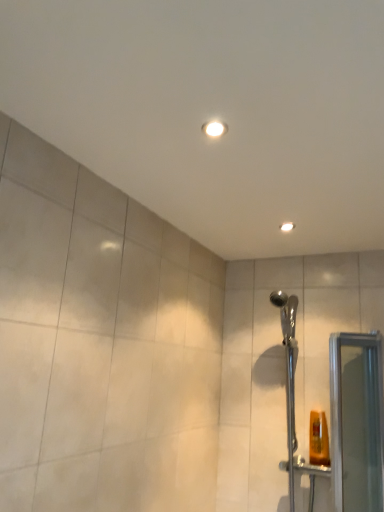
The width and height of the screenshot is (384, 512). Find the location of `chrome metallic shower head at right`. chrome metallic shower head at right is located at coordinates (x=289, y=373).

At what (x,y) coordinates should I click in order to perform the action: click on chrome metallic shower head at right. Please return your answer as a coordinate pair (x, y). Looking at the image, I should click on (289, 373).

Which of these two, clear glass screen door at right or chrome metallic shower head at right, is bigger?

chrome metallic shower head at right is bigger.

In the image, there is a chrome metallic shower head at right. Where is `screen door below it (from the image's perspective)`? screen door below it (from the image's perspective) is located at coordinates (356, 421).

Is chrome metallic shower head at right surrounded by clear glass screen door at right?

That's incorrect, chrome metallic shower head at right is not inside clear glass screen door at right.

Does clear glass screen door at right have a lesser height compared to chrome metallic shower head at right?

Correct, clear glass screen door at right is not as tall as chrome metallic shower head at right.

Locate an element on the screen. This screenshot has width=384, height=512. light fixture above the clear glass screen door at right (from the image's perspective) is located at coordinates (287, 227).

Which is behind, point (284, 226) or point (363, 335)?

The point (363, 335) is farther.

Considering the relative sizes of matte white light fixture at upper center and clear glass screen door at right in the image provided, is matte white light fixture at upper center wider than clear glass screen door at right?

Incorrect, the width of matte white light fixture at upper center does not surpass that of clear glass screen door at right.

Looking at their sizes, would you say matte white light fixture at upper center is wider or thinner than chrome metallic shower head at right?

Considering their sizes, matte white light fixture at upper center looks slimmer than chrome metallic shower head at right.

From a real-world perspective, is matte white light fixture at upper center on top of chrome metallic shower head at right?

Yes, from a real-world perspective, matte white light fixture at upper center is over chrome metallic shower head at right

Can you confirm if matte white light fixture at upper center is positioned to the right of chrome metallic shower head at right?

Incorrect, matte white light fixture at upper center is not on the right side of chrome metallic shower head at right.

Is matte white light fixture at upper center oriented away from chrome metallic shower head at right?

matte white light fixture at upper center is not turned away from chrome metallic shower head at right.

Which is more to the left, chrome metallic shower head at right or clear glass screen door at right?

From the viewer's perspective, chrome metallic shower head at right appears more on the left side.

In the scene shown: Are chrome metallic shower head at right and clear glass screen door at right located far from each other?

No, chrome metallic shower head at right is not far from clear glass screen door at right.

Is clear glass screen door at right at the back of chrome metallic shower head at right?

chrome metallic shower head at right is not turned away from clear glass screen door at right.

Considering the sizes of objects chrome metallic shower head at right and clear glass screen door at right in the image provided, who is shorter, chrome metallic shower head at right or clear glass screen door at right?

clear glass screen door at right.

From the image's perspective, is clear glass screen door at right located beneath matte white light fixture at upper center?

Correct, clear glass screen door at right appears lower than matte white light fixture at upper center in the image.

From a real-world perspective, which is physically below, clear glass screen door at right or matte white light fixture at upper center?

clear glass screen door at right is physically lower.

Does clear glass screen door at right have a smaller size compared to matte white light fixture at upper center?

Incorrect, clear glass screen door at right is not smaller in size than matte white light fixture at upper center.

Does clear glass screen door at right turn towards matte white light fixture at upper center?

No, clear glass screen door at right is not aimed at matte white light fixture at upper center.

You are a GUI agent. You are given a task and a screenshot of the screen. Output one action in this format:
    pyautogui.click(x=<x>, y=<y>)
    Task: Click on the shower below the matte white light fixture at upper center (from the image's perspective)
    The width and height of the screenshot is (384, 512).
    Given the screenshot: What is the action you would take?
    pyautogui.click(x=289, y=373)

From a real-world perspective, who is located lower, chrome metallic shower head at right or matte white light fixture at upper center?

chrome metallic shower head at right.

Which object is positioned more to the right, chrome metallic shower head at right or matte white light fixture at upper center?

Positioned to the right is chrome metallic shower head at right.

Where is `shower that appears above the clear glass screen door at right (from a real-world perspective)`? The height and width of the screenshot is (512, 384). shower that appears above the clear glass screen door at right (from a real-world perspective) is located at coordinates (289, 373).

Where is `light fixture lying behind the clear glass screen door at right`? light fixture lying behind the clear glass screen door at right is located at coordinates (287, 227).

Based on their spatial positions, is chrome metallic shower head at right or matte white light fixture at upper center further from clear glass screen door at right?

Based on the image, matte white light fixture at upper center appears to be further to clear glass screen door at right.

Which object lies further to the anchor point chrome metallic shower head at right, matte white light fixture at upper center or clear glass screen door at right?

matte white light fixture at upper center lies further to chrome metallic shower head at right than the other object.

Based on their spatial positions, is chrome metallic shower head at right or clear glass screen door at right closer to matte white light fixture at upper center?

chrome metallic shower head at right lies closer to matte white light fixture at upper center than the other object.

When comparing their distances from matte white light fixture at upper center, does clear glass screen door at right or chrome metallic shower head at right seem closer?

Among the two, chrome metallic shower head at right is located nearer to matte white light fixture at upper center.

Considering their positions, is clear glass screen door at right positioned closer to chrome metallic shower head at right than matte white light fixture at upper center?

clear glass screen door at right is positioned closer to the anchor chrome metallic shower head at right.

Considering their positions, is matte white light fixture at upper center positioned further to clear glass screen door at right than chrome metallic shower head at right?

Based on the image, matte white light fixture at upper center appears to be further to clear glass screen door at right.

The width and height of the screenshot is (384, 512). In order to click on shower between matte white light fixture at upper center and clear glass screen door at right in the vertical direction in this screenshot , I will do `click(289, 373)`.